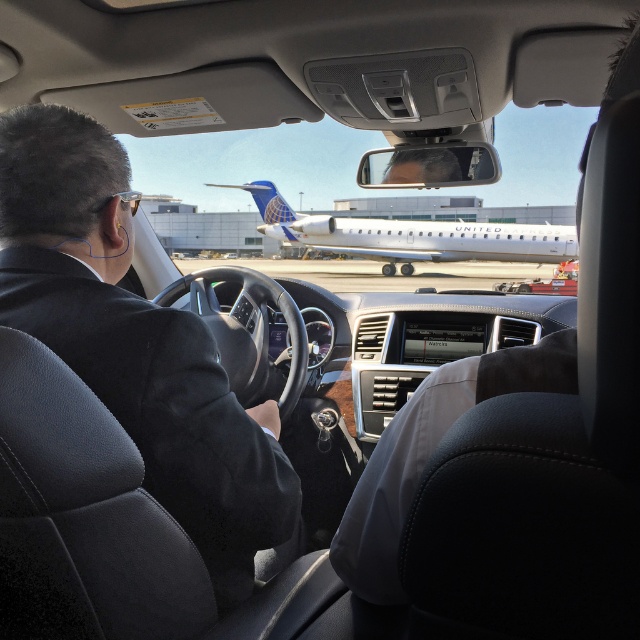
Based on the photo, you are a passenger in the car and want to describe what you see. Which object, the dark gray suit at center or the white metallic airplane at center, appears narrower from your viewpoint?

The dark gray suit at center appears narrower than the white metallic airplane at center from the passenger seat perspective.

You are sitting in the passenger seat of the car and looking through the windshield. There are two points marked on the windshield. The first point is at coordinates point (65,291) and the second point is at point (470,234). Which point is closer to you?

Point (65,291) is in front of point (470,234), so it is closer to you.

You are a passenger in the car and want to compare the sizes of the objects you see. Which object, the dark gray suit at center or the white metallic airplane at center, appears smaller in the image?

The dark gray suit at center appears smaller compared to the white metallic airplane at center in the image.